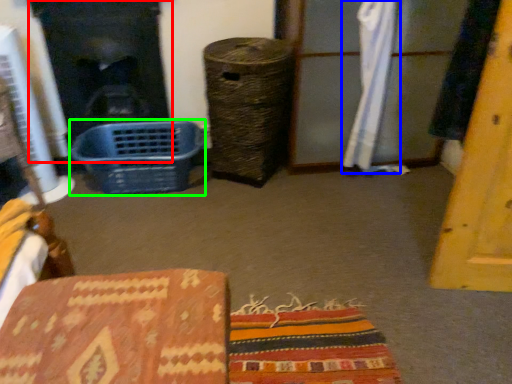
Question: Considering the real-world distances, which object is farthest from fireplace (highlighted by a red box)? curtain (highlighted by a blue box) or basket (highlighted by a green box)?

Choices:
 (A) curtain
 (B) basket

Answer: (A)